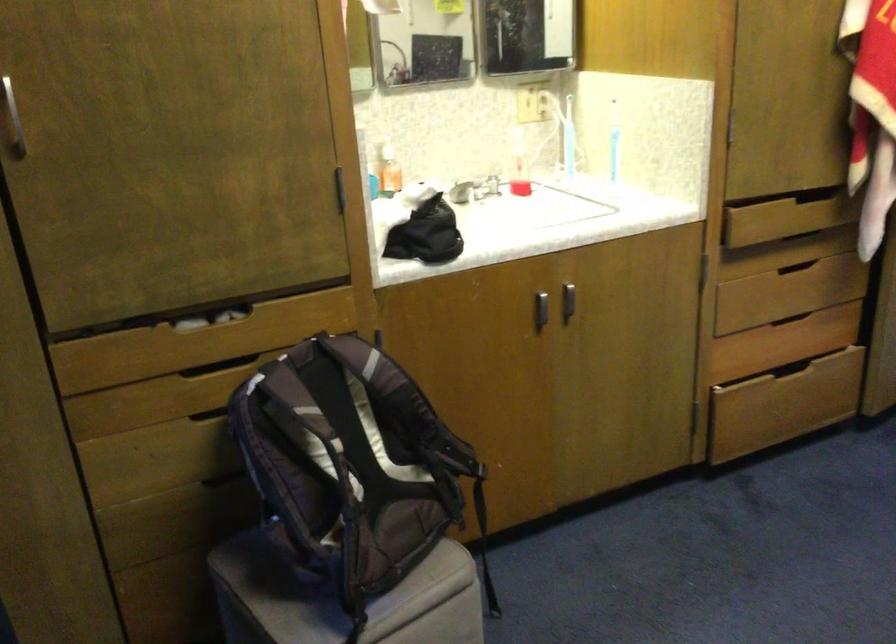
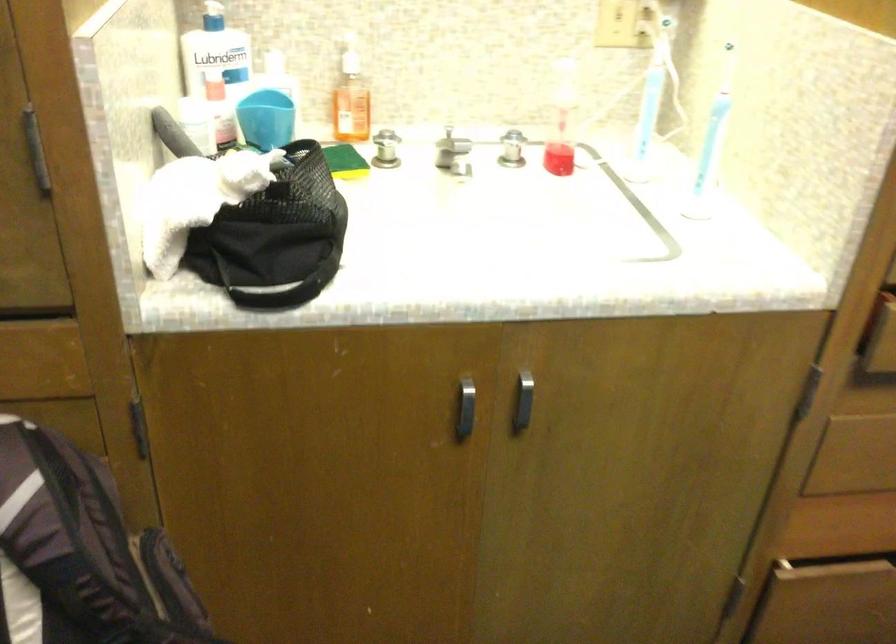
Which direction would the cameraman need to move to produce the second image?

The movement direction of the cameraman is right, forward.